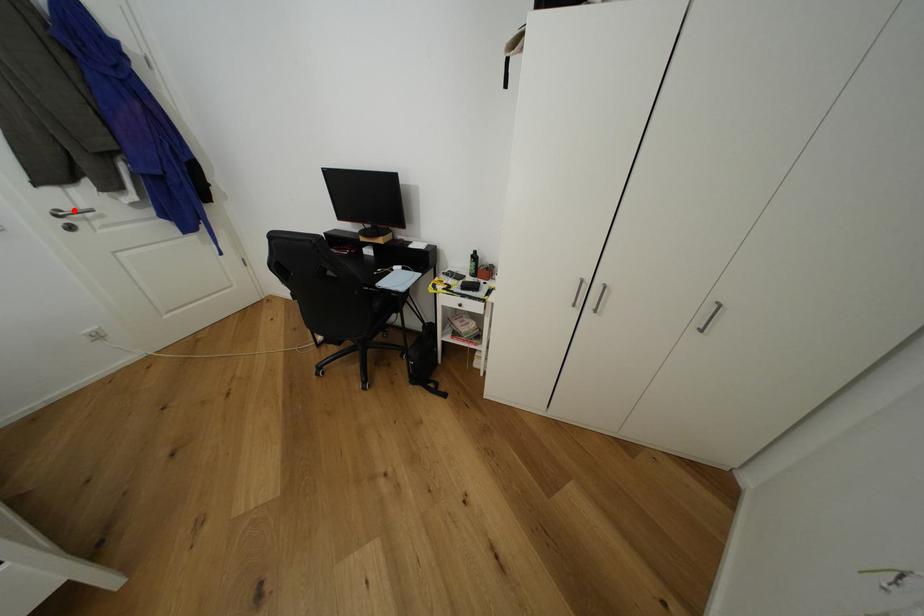
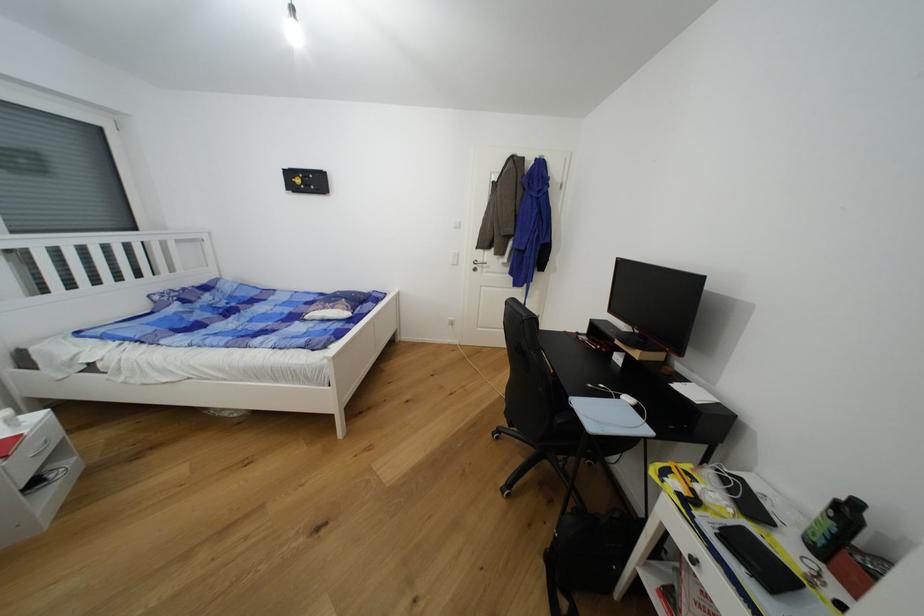
Where in the second image is the point corresponding to the highlighted location from the first image?

(484, 262)